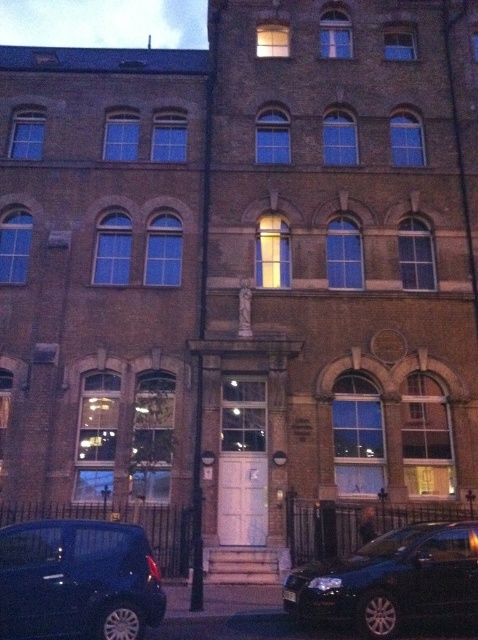
Question: Does shiny blue car at lower left appear on the right side of black metallic car at lower right?

Choices:
 (A) yes
 (B) no

Answer: (B)

Question: Does shiny blue car at lower left have a greater width compared to black metallic car at lower right?

Choices:
 (A) yes
 (B) no

Answer: (B)

Question: Which of the following is the farthest from the observer?

Choices:
 (A) (340, 616)
 (B) (140, 592)

Answer: (A)

Question: Which object is farther from the camera taking this photo?

Choices:
 (A) black metallic car at lower right
 (B) shiny blue car at lower left

Answer: (A)

Question: Can you confirm if shiny blue car at lower left is positioned to the left of black metallic car at lower right?

Choices:
 (A) yes
 (B) no

Answer: (A)